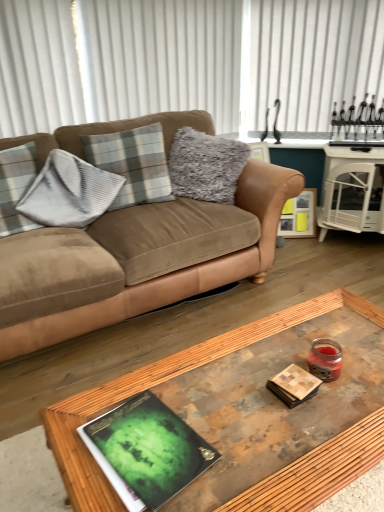
Find the location of a particular element. vacant space to the right of green matte book at center is located at coordinates (251, 437).